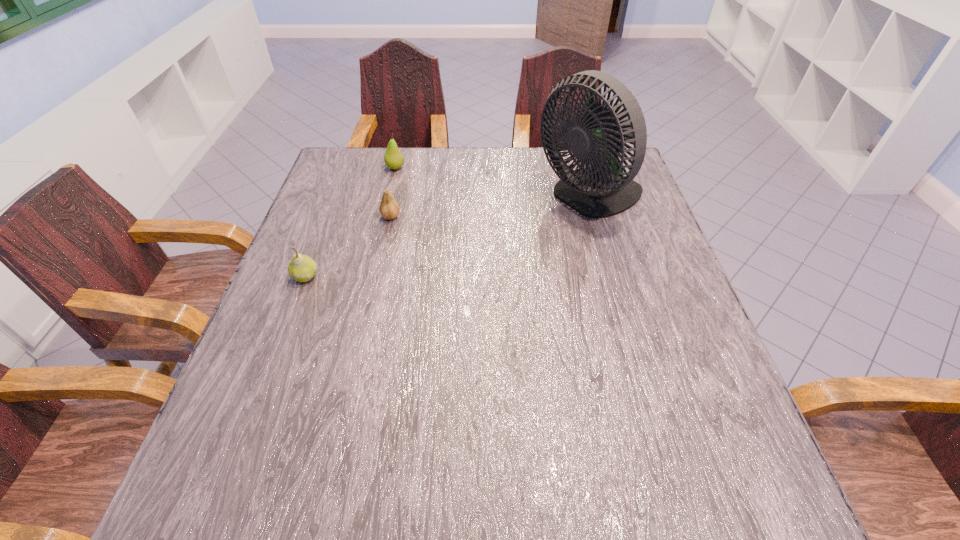
In the image, there is a desktop. Identify the location of vacant area at the right edge. Image resolution: width=960 pixels, height=540 pixels. (633, 283).

Identify the location of vacant space at the far left corner of the desktop. (351, 191).

Find the location of `vacant region at the near left corner of the desktop`. vacant region at the near left corner of the desktop is located at coordinates (244, 492).

This screenshot has height=540, width=960. I want to click on vacant space at the near right corner, so click(x=739, y=468).

Identify the location of vacant space that's between the second farthest pear and the farthest pear. (393, 192).

At what (x,y) coordinates should I click in order to perform the action: click on vacant space in between the farthest pear and the tallest object. Please return your answer as a coordinate pair (x, y). Looking at the image, I should click on (492, 183).

Identify the location of free space between the farthest pear and the fan. The height and width of the screenshot is (540, 960). (492, 183).

Where is `vacant area between the farthest pear and the leftmost pear`? Image resolution: width=960 pixels, height=540 pixels. vacant area between the farthest pear and the leftmost pear is located at coordinates (350, 222).

At what (x,y) coordinates should I click in order to perform the action: click on empty space between the farthest pear and the second farthest pear. Please return your answer as a coordinate pair (x, y). This screenshot has width=960, height=540. Looking at the image, I should click on (393, 192).

Find the location of a particular element. The height and width of the screenshot is (540, 960). empty space that is in between the second farthest pear and the fan is located at coordinates (491, 207).